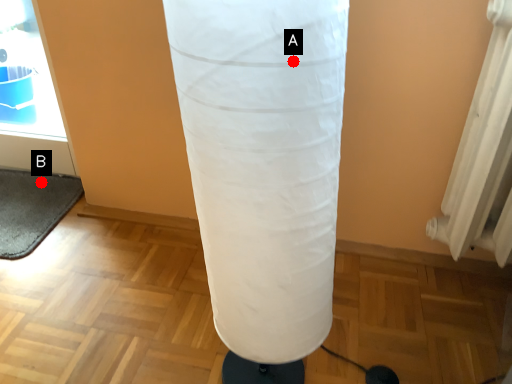
Question: Two points are circled on the image, labeled by A and B beside each circle. Which point appears farthest from the camera in this image?

Choices:
 (A) A is further
 (B) B is further

Answer: (B)